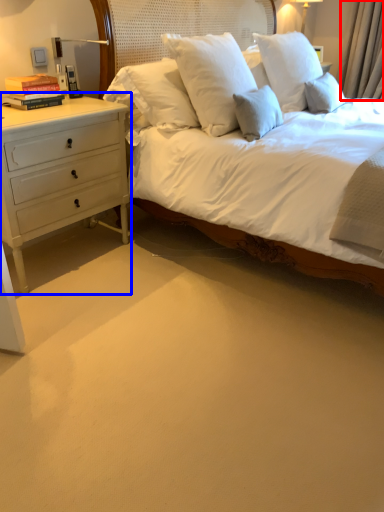
Question: Which point is further to the camera, curtain (highlighted by a red box) or chest of drawers (highlighted by a blue box)?

Choices:
 (A) curtain
 (B) chest of drawers

Answer: (A)